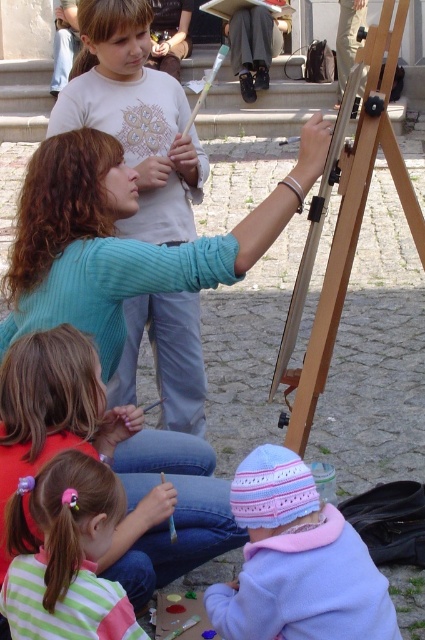
Is striped cotton shirt at lower left smaller than pink hairband at lower left?

Incorrect, striped cotton shirt at lower left is not smaller in size than pink hairband at lower left.

Is point (50, 435) less distant than point (42, 474)?

No.

This screenshot has width=425, height=640. Describe the element at coordinates (110, 461) in the screenshot. I see `striped cotton shirt at lower left` at that location.

Image resolution: width=425 pixels, height=640 pixels. I want to click on striped cotton shirt at lower left, so click(110, 461).

Does pink hairband at lower left come in front of wooden easel at center?

Yes.

Does pink hairband at lower left have a larger size compared to wooden easel at center?

Actually, pink hairband at lower left might be smaller than wooden easel at center.

Does point (62, 522) come farther from viewer compared to point (328, 336)?

No, it is not.

At what (x,y) coordinates should I click in order to perform the action: click on pink hairband at lower left. Please return your answer as a coordinate pair (x, y). Looking at the image, I should click on (67, 556).

The height and width of the screenshot is (640, 425). I want to click on teal ribbed sweater at upper left, so click(121, 240).

In the scene shown: Between teal ribbed sweater at upper left and wooden easel at center, which one appears on the right side from the viewer's perspective?

Positioned to the right is wooden easel at center.

What do you see at coordinates (121, 240) in the screenshot? This screenshot has height=640, width=425. I see `teal ribbed sweater at upper left` at bounding box center [121, 240].

Where is `teal ribbed sweater at upper left`? This screenshot has height=640, width=425. teal ribbed sweater at upper left is located at coordinates (121, 240).